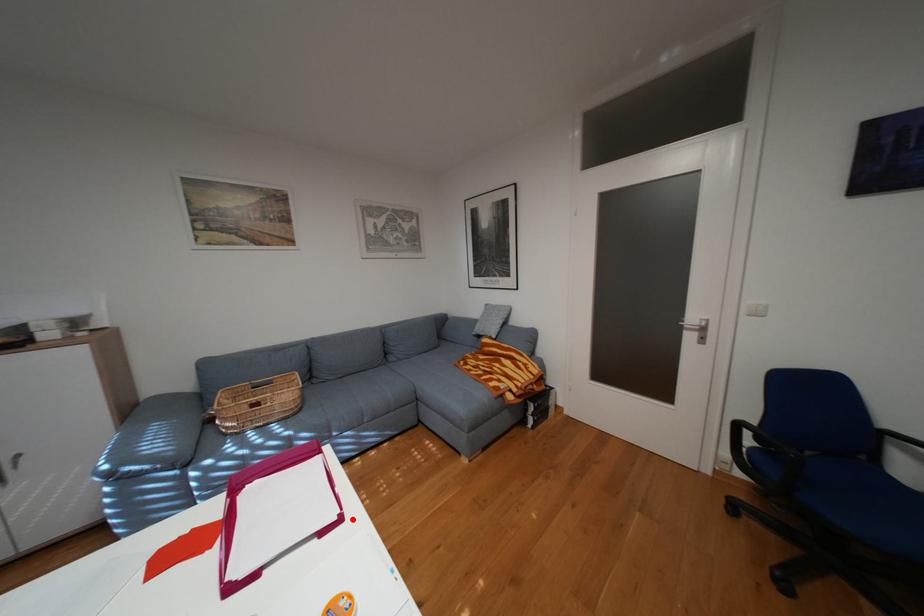
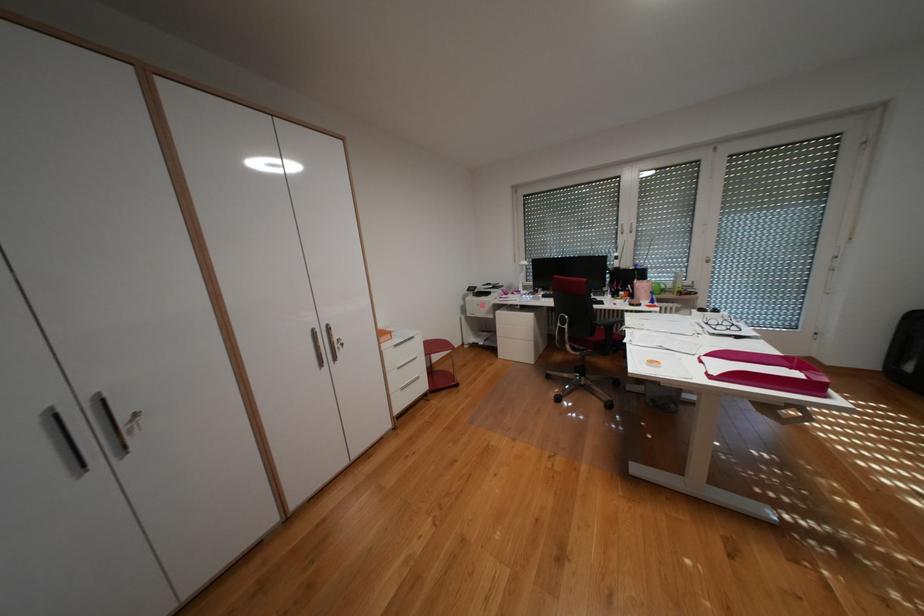
Question: I am providing you with two images of the same scene from different viewpoints. Given a red point in image1, look at the same physical point in image2. Is it:

Choices:
 (A) Closer to the viewpoint
 (B) Farther from the viewpoint

Answer: (B)